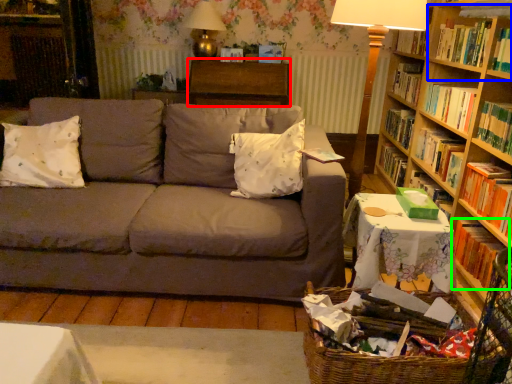
Question: Which object is positioned farthest from table (highlighted by a red box)? Select from shelf (highlighted by a blue box) and book (highlighted by a green box).

Choices:
 (A) shelf
 (B) book

Answer: (B)